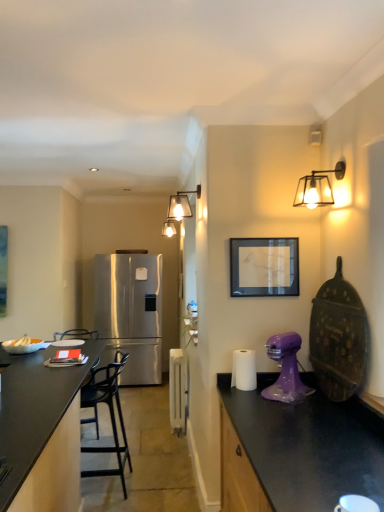
Question: From a real-world perspective, is satin stainless steel refrigerator at center located beneath metallic glass sconce at upper right, which ranks as the second light fixture in back-to-front order?

Choices:
 (A) no
 (B) yes

Answer: (B)

Question: Considering the relative sizes of satin stainless steel refrigerator at center and metallic glass sconce at upper right, which is the first light fixture in front-to-back order, in the image provided, is satin stainless steel refrigerator at center smaller than metallic glass sconce at upper right, which is the first light fixture in front-to-back order,?

Choices:
 (A) no
 (B) yes

Answer: (A)

Question: Does satin stainless steel refrigerator at center appear on the left side of metallic glass sconce at upper right, which is the first light fixture in front-to-back order?

Choices:
 (A) no
 (B) yes

Answer: (B)

Question: Is satin stainless steel refrigerator at center behind metallic glass sconce at upper right, which is the first light fixture in front-to-back order?

Choices:
 (A) yes
 (B) no

Answer: (A)

Question: Is satin stainless steel refrigerator at center oriented away from metallic glass sconce at upper right, which ranks as the 2th light fixture in left-to-right order?

Choices:
 (A) yes
 (B) no

Answer: (B)

Question: Considering the positions of purple plastic mixer at right and white glossy coffee cup at lower right in the image, is purple plastic mixer at right bigger or smaller than white glossy coffee cup at lower right?

Choices:
 (A) small
 (B) big

Answer: (B)

Question: From a real-world perspective, is purple plastic mixer at right above or below white glossy coffee cup at lower right?

Choices:
 (A) above
 (B) below

Answer: (A)

Question: Is purple plastic mixer at right taller or shorter than white glossy coffee cup at lower right?

Choices:
 (A) short
 (B) tall

Answer: (B)

Question: Is purple plastic mixer at right inside or outside of white glossy coffee cup at lower right?

Choices:
 (A) inside
 (B) outside

Answer: (B)

Question: Is white glossy radiator at center, arranged as the second appliance when viewed from the front, in front of or behind black matte chair at center in the image?

Choices:
 (A) behind
 (B) front

Answer: (A)

Question: Is white glossy radiator at center, which is the second appliance in top-to-bottom order, inside the boundaries of black matte chair at center, or outside?

Choices:
 (A) outside
 (B) inside

Answer: (A)

Question: Is point (185, 431) positioned closer to the camera than point (97, 399)?

Choices:
 (A) closer
 (B) farther

Answer: (B)

Question: Considering the relative positions of white glossy radiator at center, placed as the first appliance when sorted from left to right, and black matte chair at center in the image provided, is white glossy radiator at center, placed as the first appliance when sorted from left to right, to the left or to the right of black matte chair at center?

Choices:
 (A) left
 (B) right

Answer: (B)

Question: Is point (319, 185) positioned closer to the camera than point (152, 256)?

Choices:
 (A) closer
 (B) farther

Answer: (A)

Question: Visually, is metallic glass sconce at upper right, which ranks as the 2th light fixture in left-to-right order, positioned to the left or to the right of satin stainless steel refrigerator at center?

Choices:
 (A) right
 (B) left

Answer: (A)